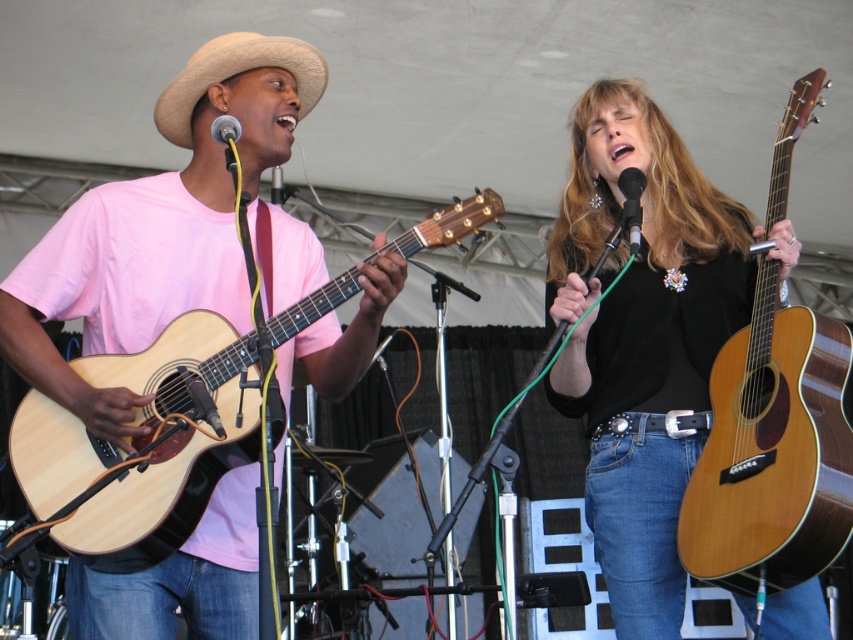
Question: Is black metallic microphone at upper center to the left of metallic silver microphone at upper center from the viewer's perspective?

Choices:
 (A) yes
 (B) no

Answer: (B)

Question: Which object is closer to the camera taking this photo?

Choices:
 (A) black metallic microphone at upper center
 (B) beige straw cowboy hat at upper left
 (C) natural wood acoustic guitar at left
 (D) metallic silver microphone at upper center

Answer: (C)

Question: Which point appears closest to the camera in this image?

Choices:
 (A) (776, 529)
 (B) (260, 65)
 (C) (222, 134)
 (D) (751, 304)

Answer: (C)

Question: Is matte black guitar at right wider than metallic silver microphone at upper center?

Choices:
 (A) yes
 (B) no

Answer: (A)

Question: Can you confirm if black metallic microphone at upper center is positioned above metallic silver microphone at upper center?

Choices:
 (A) yes
 (B) no

Answer: (B)

Question: Which point appears farthest from the camera in this image?

Choices:
 (A) (186, 348)
 (B) (708, 531)
 (C) (642, 99)
 (D) (236, 140)

Answer: (C)